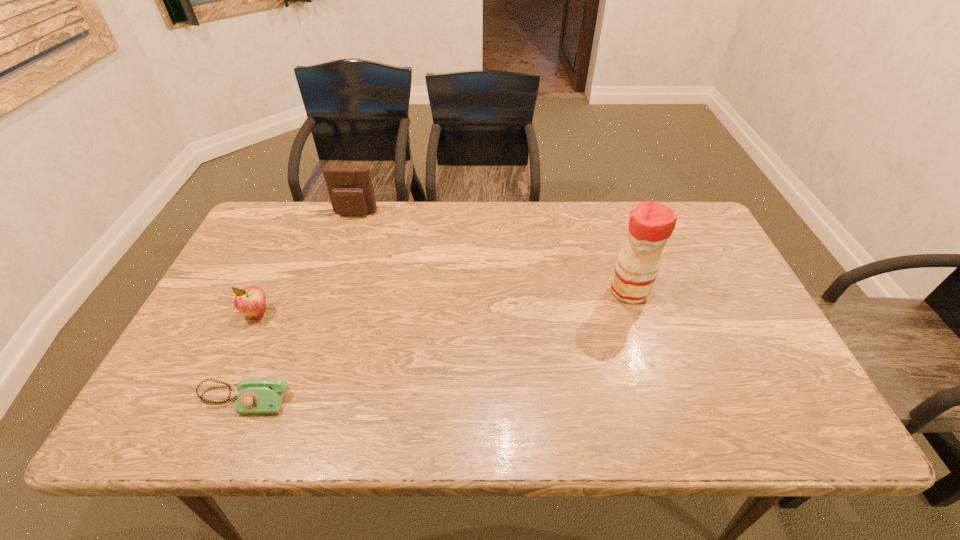
Locate an element on the screen. The image size is (960, 540). object present at the far edge is located at coordinates (351, 192).

I want to click on object that is positioned at the near edge, so click(x=256, y=396).

The height and width of the screenshot is (540, 960). I want to click on apple present at the left edge, so click(x=251, y=301).

The image size is (960, 540). Identify the location of telephone situated at the left edge. (256, 396).

This screenshot has width=960, height=540. Find the location of `object present at the near left corner`. object present at the near left corner is located at coordinates (256, 396).

Where is `blank space at the far edge of the desktop`? blank space at the far edge of the desktop is located at coordinates click(x=629, y=210).

You are a GUI agent. You are given a task and a screenshot of the screen. Output one action in this format:
    pyautogui.click(x=<x>, y=<y>)
    Task: Click on the free space at the near edge of the desktop
    Image resolution: width=960 pixels, height=540 pixels.
    Given the screenshot: What is the action you would take?
    pyautogui.click(x=399, y=422)

The height and width of the screenshot is (540, 960). I want to click on vacant space at the left edge of the desktop, so click(x=208, y=313).

Find the location of a particular element. Image resolution: width=960 pixels, height=540 pixels. vacant space at the right edge of the desktop is located at coordinates (712, 265).

Image resolution: width=960 pixels, height=540 pixels. In order to click on vacant region at the far left corner in this screenshot , I will do `click(303, 227)`.